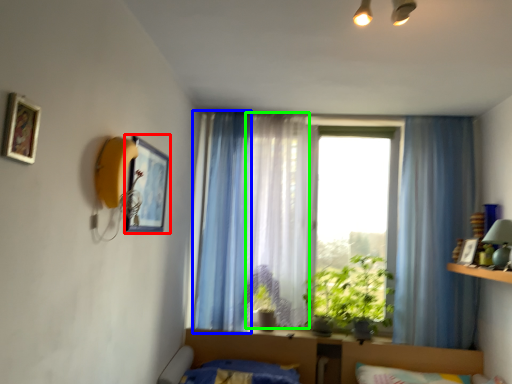
Question: Which object is positioned farthest from picture frame (highlighted by a red box)? Select from curtain (highlighted by a blue box) and curtain (highlighted by a green box).

Choices:
 (A) curtain
 (B) curtain

Answer: (B)